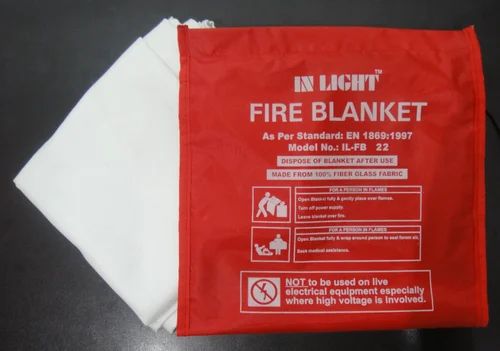
At what (x,y) coordinates should I click in order to perform the action: click on white fire blanket. Please return your answer as a coordinate pair (x, y). The height and width of the screenshot is (351, 500). Looking at the image, I should click on (155, 146).